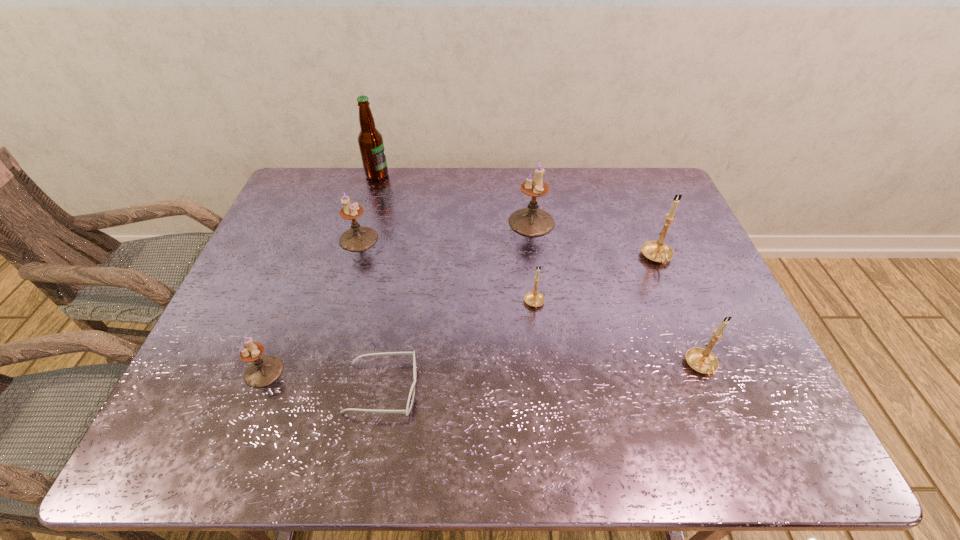
Locate an element on the screen. Image resolution: width=960 pixels, height=540 pixels. brown beer bottle is located at coordinates (370, 140).

Where is `beer bottle`? beer bottle is located at coordinates (370, 140).

Where is `the biggest gold candle holder`? This screenshot has width=960, height=540. the biggest gold candle holder is located at coordinates (657, 251).

This screenshot has height=540, width=960. I want to click on the rightmost purple candle holder, so click(531, 221).

Locate an element on the screen. The height and width of the screenshot is (540, 960). the second purple candle holder from left to right is located at coordinates (358, 238).

Image resolution: width=960 pixels, height=540 pixels. What are the coordinates of `the fifth candle holder from right to left` in the screenshot? It's located at (358, 238).

The width and height of the screenshot is (960, 540). In order to click on the second smallest gold candle holder in this screenshot , I will do `click(701, 360)`.

Locate an element on the screen. the second farthest gold candle holder is located at coordinates (534, 298).

Where is `the leftmost gold candle holder`? The width and height of the screenshot is (960, 540). the leftmost gold candle holder is located at coordinates (534, 298).

Find the location of a particular element. The width and height of the screenshot is (960, 540). the nearest purple candle holder is located at coordinates (263, 371).